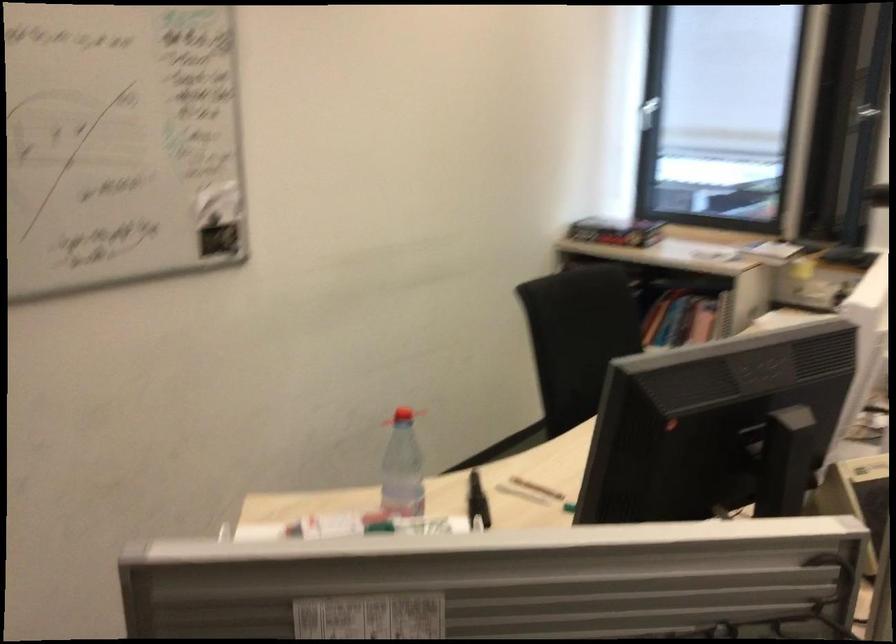
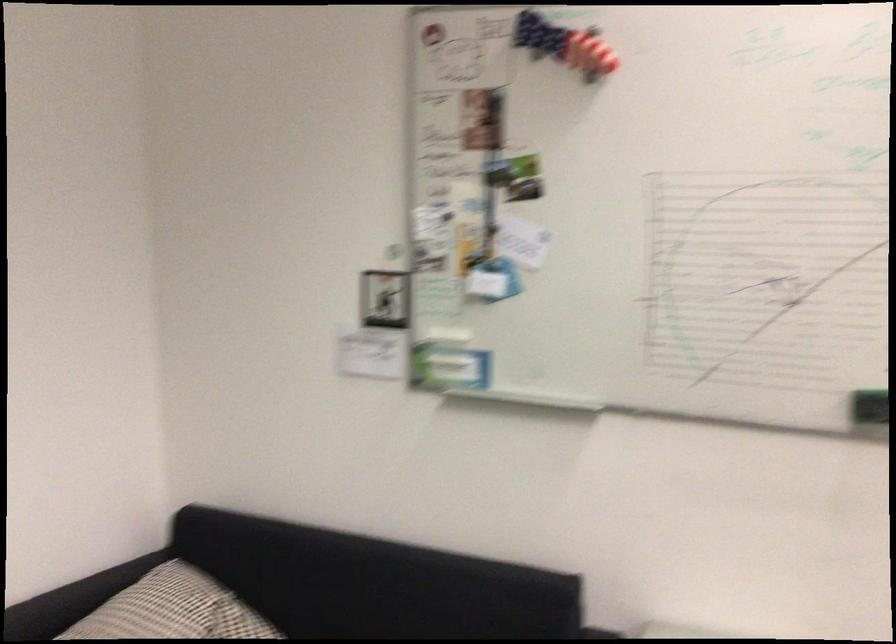
Question: How did the camera likely rotate?

Choices:
 (A) Left
 (B) Right
 (C) Up
 (D) Down

Answer: (A)